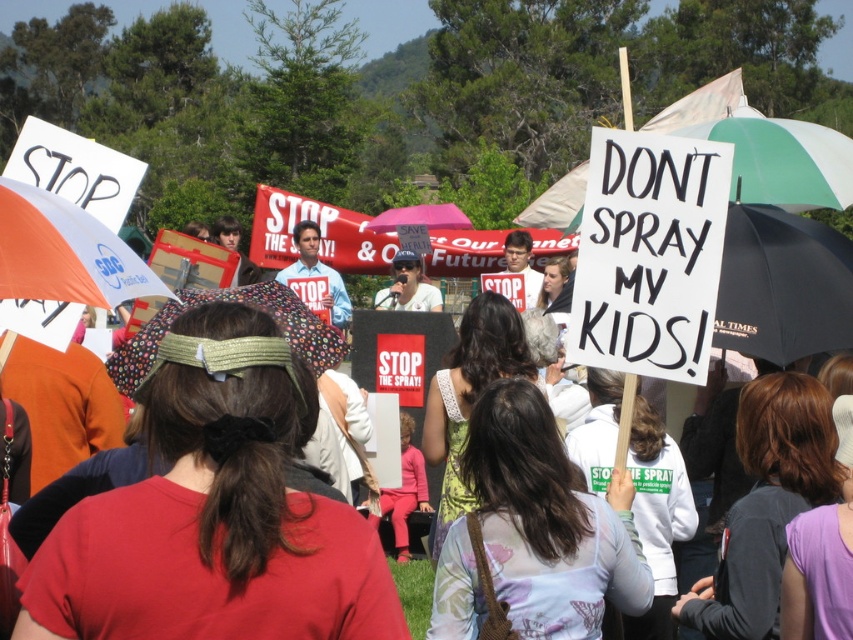
Question: Which object appears farthest from the camera in this image?

Choices:
 (A) floral fabric umbrella at center
 (B) orange fabric umbrella at upper left

Answer: (A)

Question: Which object appears closest to the camera in this image?

Choices:
 (A) floral fabric umbrella at center
 (B) orange fabric umbrella at upper left

Answer: (B)

Question: Does orange fabric umbrella at upper left appear on the left side of floral fabric umbrella at center?

Choices:
 (A) no
 (B) yes

Answer: (B)

Question: Is orange fabric umbrella at upper left bigger than floral fabric umbrella at center?

Choices:
 (A) no
 (B) yes

Answer: (B)

Question: Can you confirm if orange fabric umbrella at upper left is bigger than floral fabric umbrella at center?

Choices:
 (A) no
 (B) yes

Answer: (B)